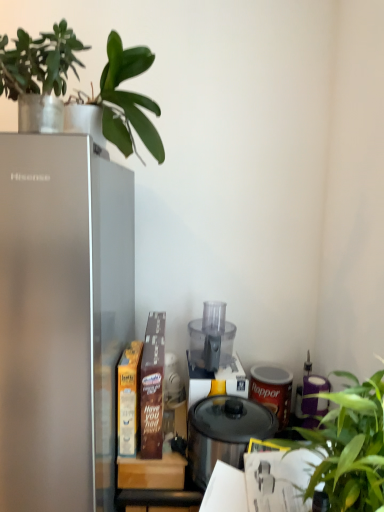
Question: Is satin silver refrigerator at left thinner than transparent plastic blender at center?

Choices:
 (A) no
 (B) yes

Answer: (A)

Question: Does satin silver refrigerator at left appear on the left side of transparent plastic blender at center?

Choices:
 (A) yes
 (B) no

Answer: (A)

Question: From the image's perspective, is satin silver refrigerator at left located beneath transparent plastic blender at center?

Choices:
 (A) yes
 (B) no

Answer: (A)

Question: Is satin silver refrigerator at left oriented towards transparent plastic blender at center?

Choices:
 (A) no
 (B) yes

Answer: (A)

Question: Is satin silver refrigerator at left smaller than transparent plastic blender at center?

Choices:
 (A) no
 (B) yes

Answer: (A)

Question: Is satin silver refrigerator at left positioned beyond the bounds of transparent plastic blender at center?

Choices:
 (A) no
 (B) yes

Answer: (B)

Question: Is satin silver refrigerator at left smaller than green matte plant at upper left, placed as the 1th houseplant when sorted from top to bottom?

Choices:
 (A) no
 (B) yes

Answer: (A)

Question: From a real-world perspective, is satin silver refrigerator at left beneath green matte plant at upper left, which is the second houseplant in right-to-left order?

Choices:
 (A) yes
 (B) no

Answer: (A)

Question: Can you see satin silver refrigerator at left touching green matte plant at upper left, which ranks as the first houseplant in left-to-right order?

Choices:
 (A) yes
 (B) no

Answer: (B)

Question: Considering the relative positions of satin silver refrigerator at left and green matte plant at upper left, which ranks as the first houseplant in left-to-right order, in the image provided, is satin silver refrigerator at left to the right of green matte plant at upper left, which ranks as the first houseplant in left-to-right order, from the viewer's perspective?

Choices:
 (A) no
 (B) yes

Answer: (A)

Question: From a real-world perspective, is satin silver refrigerator at left located higher than green matte plant at upper left, which is the second houseplant in right-to-left order?

Choices:
 (A) yes
 (B) no

Answer: (B)

Question: From the image's perspective, is satin silver refrigerator at left beneath green matte plant at upper left, which is the second houseplant in right-to-left order?

Choices:
 (A) no
 (B) yes

Answer: (B)

Question: Does green leafy plant at right, which is the second houseplant from left to right, turn towards transparent plastic blender at center?

Choices:
 (A) no
 (B) yes

Answer: (A)